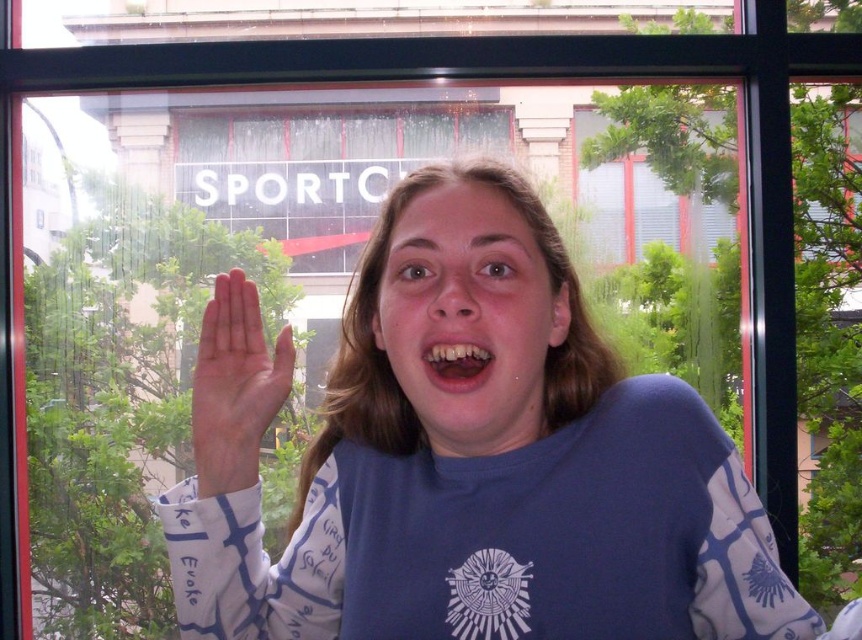
Question: Can you confirm if matte skin face at center is positioned above yellowish matte teeth at center?

Choices:
 (A) no
 (B) yes

Answer: (B)

Question: Observing the image, what is the correct spatial positioning of matte skin face at center in reference to yellowish matte teeth at center?

Choices:
 (A) below
 (B) above

Answer: (B)

Question: Which object appears closest to the camera in this image?

Choices:
 (A) pink smooth palm at center
 (B) yellowish matte teeth at center
 (C) matte skin face at center

Answer: (C)

Question: Can you confirm if matte skin face at center is positioned to the right of pink smooth palm at center?

Choices:
 (A) yes
 (B) no

Answer: (A)

Question: Which point is closer to the camera taking this photo?

Choices:
 (A) (454, 340)
 (B) (211, 381)

Answer: (A)

Question: Which object is the closest to the yellowish matte teeth at center?

Choices:
 (A) pink smooth palm at center
 (B) matte skin face at center
 (C) blue cotton shirt at center

Answer: (B)